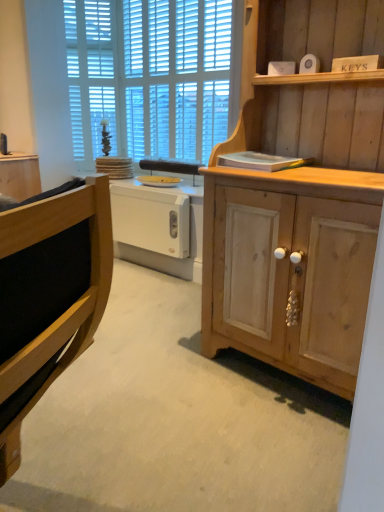
Question: Is the position of white plastic drawer at center more distant than that of wooden cabinet at left, arranged as the 1th cabinetry when viewed from the back?

Choices:
 (A) no
 (B) yes

Answer: (A)

Question: Is white plastic drawer at center at the right side of wooden cabinet at left, arranged as the 1th cabinetry when viewed from the back?

Choices:
 (A) yes
 (B) no

Answer: (A)

Question: From the image's perspective, would you say white plastic drawer at center is shown under wooden cabinet at left, which is the second cabinetry from front to back?

Choices:
 (A) no
 (B) yes

Answer: (B)

Question: From a real-world perspective, is white plastic drawer at center physically above wooden cabinet at left, which is the second cabinetry from front to back?

Choices:
 (A) no
 (B) yes

Answer: (A)

Question: Considering the relative sizes of white plastic drawer at center and wooden cabinet at left, which ranks as the first cabinetry in left-to-right order, in the image provided, is white plastic drawer at center thinner than wooden cabinet at left, which ranks as the first cabinetry in left-to-right order,?

Choices:
 (A) yes
 (B) no

Answer: (A)

Question: Based on their sizes in the image, would you say natural wood cabinet at right, which is counted as the second cabinetry, starting from the left, is bigger or smaller than white plastic radiator at center?

Choices:
 (A) small
 (B) big

Answer: (B)

Question: Considering the positions of point (339, 159) and point (150, 177), is point (339, 159) closer or farther from the camera than point (150, 177)?

Choices:
 (A) farther
 (B) closer

Answer: (B)

Question: Looking at their shapes, would you say natural wood cabinet at right, the 2th cabinetry from the back, is wider or thinner than white plastic radiator at center?

Choices:
 (A) thin
 (B) wide

Answer: (B)

Question: In the image, is natural wood cabinet at right, the 2th cabinetry from the back, positioned in front of or behind white plastic radiator at center?

Choices:
 (A) behind
 (B) front

Answer: (B)

Question: Is point pyautogui.click(x=357, y=72) closer or farther from the camera than point pyautogui.click(x=162, y=226)?

Choices:
 (A) closer
 (B) farther

Answer: (A)

Question: Choose the correct answer: Is natural wood cabinet at right, the first cabinetry when ordered from right to left, inside white plastic drawer at center or outside it?

Choices:
 (A) outside
 (B) inside

Answer: (A)

Question: From a real-world perspective, is natural wood cabinet at right, the 1th cabinetry when ordered from front to back, physically located above or below white plastic drawer at center?

Choices:
 (A) above
 (B) below

Answer: (A)

Question: Would you say natural wood cabinet at right, which is counted as the second cabinetry, starting from the left, is to the left or to the right of white plastic drawer at center in the picture?

Choices:
 (A) left
 (B) right

Answer: (B)

Question: Is white plastic radiator at center spatially inside natural wood cabinet at right, the first cabinetry when ordered from right to left, or outside of it?

Choices:
 (A) outside
 (B) inside

Answer: (A)

Question: In terms of width, does white plastic radiator at center look wider or thinner when compared to natural wood cabinet at right, the 1th cabinetry when ordered from front to back?

Choices:
 (A) wide
 (B) thin

Answer: (B)